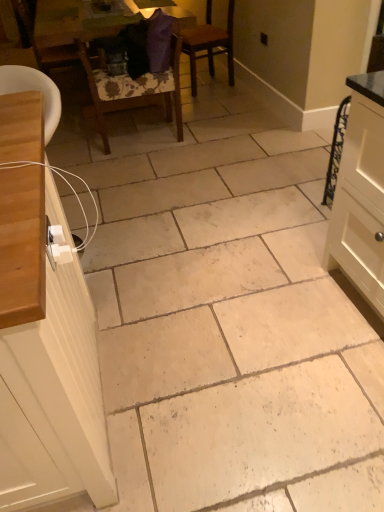
Question: Should I look upward or downward to see wooden chair at left, which is the third chair in right-to-left order?

Choices:
 (A) up
 (B) down

Answer: (A)

Question: From a real-world perspective, is wooden table at upper center located higher than brown wooden chair at center, which is the third chair from left to right?

Choices:
 (A) yes
 (B) no

Answer: (B)

Question: Is wooden table at upper center aimed at brown wooden chair at center, which is the third chair from left to right?

Choices:
 (A) no
 (B) yes

Answer: (A)

Question: Would you say wooden table at upper center is outside brown wooden chair at center, which is the third chair from left to right?

Choices:
 (A) no
 (B) yes

Answer: (B)

Question: Considering the relative sizes of wooden table at upper center and brown wooden chair at center, which is the third chair from left to right, in the image provided, is wooden table at upper center wider than brown wooden chair at center, which is the third chair from left to right,?

Choices:
 (A) yes
 (B) no

Answer: (A)

Question: Considering the relative sizes of wooden table at upper center and brown wooden chair at center, arranged as the first chair when viewed from the right, in the image provided, is wooden table at upper center thinner than brown wooden chair at center, arranged as the first chair when viewed from the right,?

Choices:
 (A) yes
 (B) no

Answer: (B)

Question: Is wooden table at upper center turned away from brown wooden chair at center, which is the third chair from left to right?

Choices:
 (A) yes
 (B) no

Answer: (B)

Question: Is wooden table at upper center smaller than white matte cabinet at left?

Choices:
 (A) no
 (B) yes

Answer: (A)

Question: From the image's perspective, is wooden table at upper center beneath white matte cabinet at left?

Choices:
 (A) yes
 (B) no

Answer: (B)

Question: Is wooden table at upper center not inside white matte cabinet at left?

Choices:
 (A) no
 (B) yes

Answer: (B)

Question: From a real-world perspective, is wooden table at upper center on white matte cabinet at left?

Choices:
 (A) yes
 (B) no

Answer: (B)

Question: Is wooden table at upper center behind white matte cabinet at left?

Choices:
 (A) yes
 (B) no

Answer: (A)

Question: Considering the relative positions of wooden table at upper center and white matte cabinet at left in the image provided, is wooden table at upper center to the right of white matte cabinet at left from the viewer's perspective?

Choices:
 (A) no
 (B) yes

Answer: (A)

Question: Considering the relative sizes of brown wooden chair at center, arranged as the first chair when viewed from the right, and wooden table at upper center in the image provided, is brown wooden chair at center, arranged as the first chair when viewed from the right, shorter than wooden table at upper center?

Choices:
 (A) no
 (B) yes

Answer: (A)